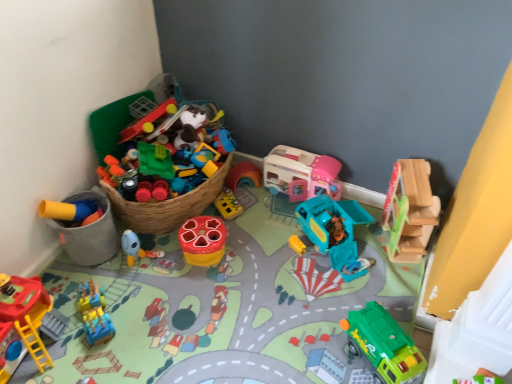
Where is `vacant area located to the right-hand side of teal plastic truck at center, which is the 6th toy in left-to-right order`? vacant area located to the right-hand side of teal plastic truck at center, which is the 6th toy in left-to-right order is located at coordinates (376, 254).